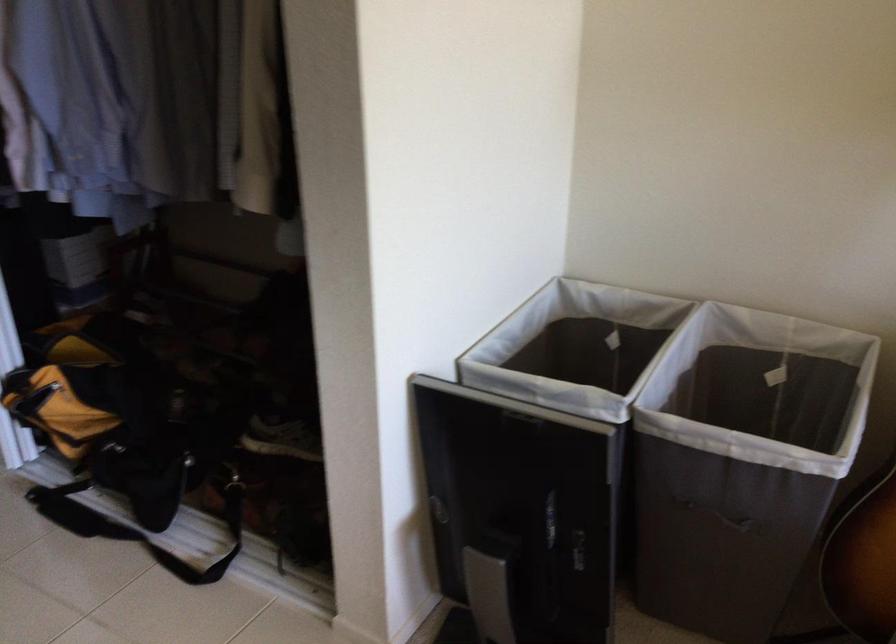
What do you see at coordinates (133, 527) in the screenshot? I see `the black bag strap` at bounding box center [133, 527].